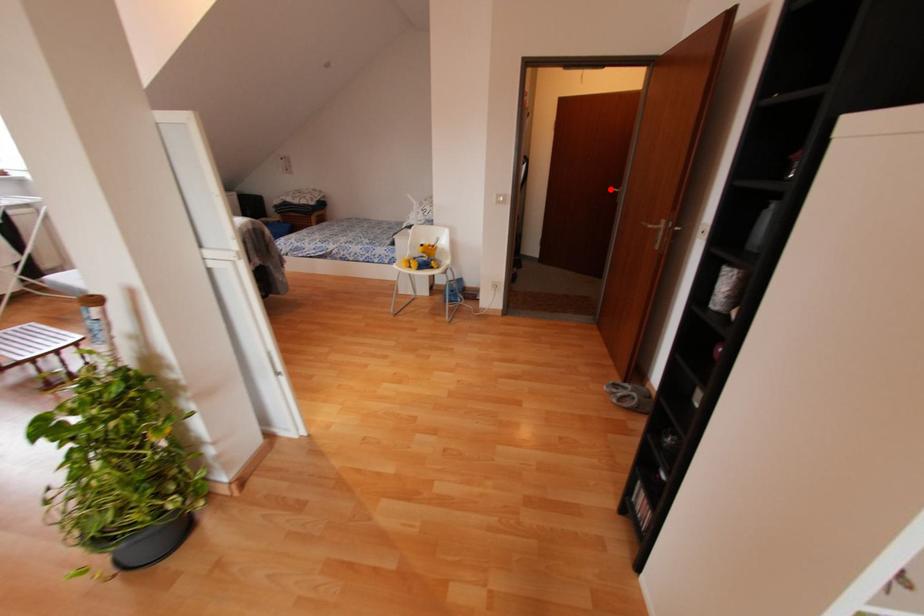
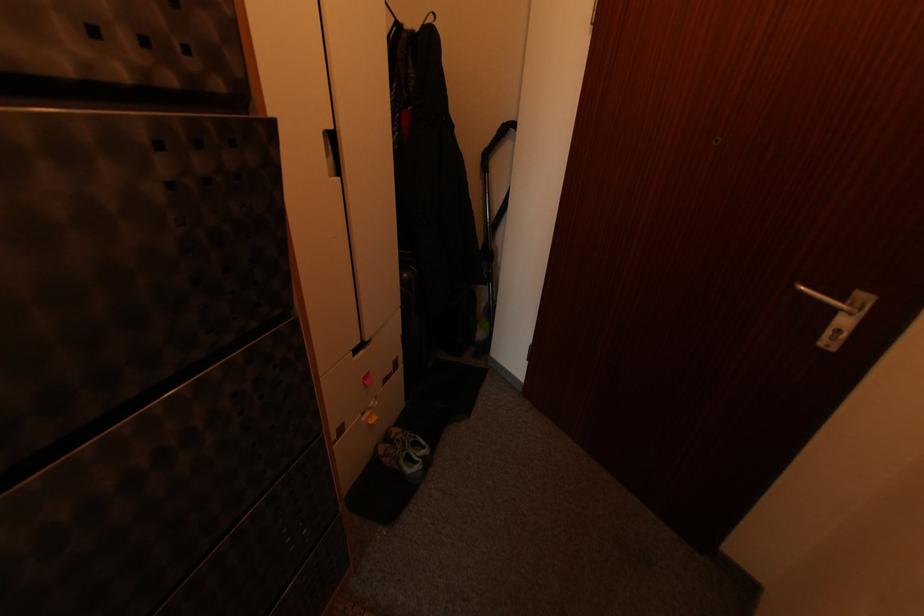
The point at the highlighted location is marked in the first image. Where is the corresponding point in the second image?

(804, 289)